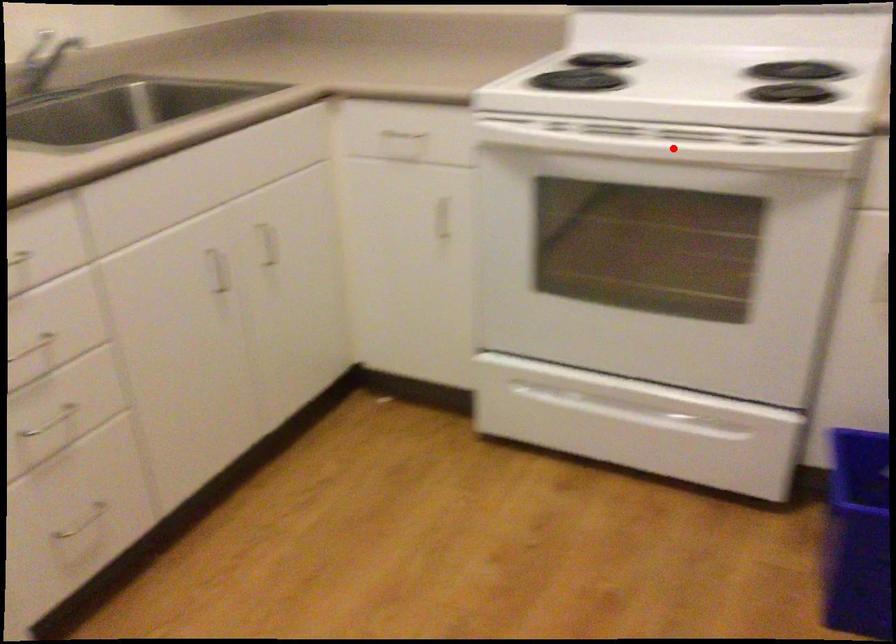
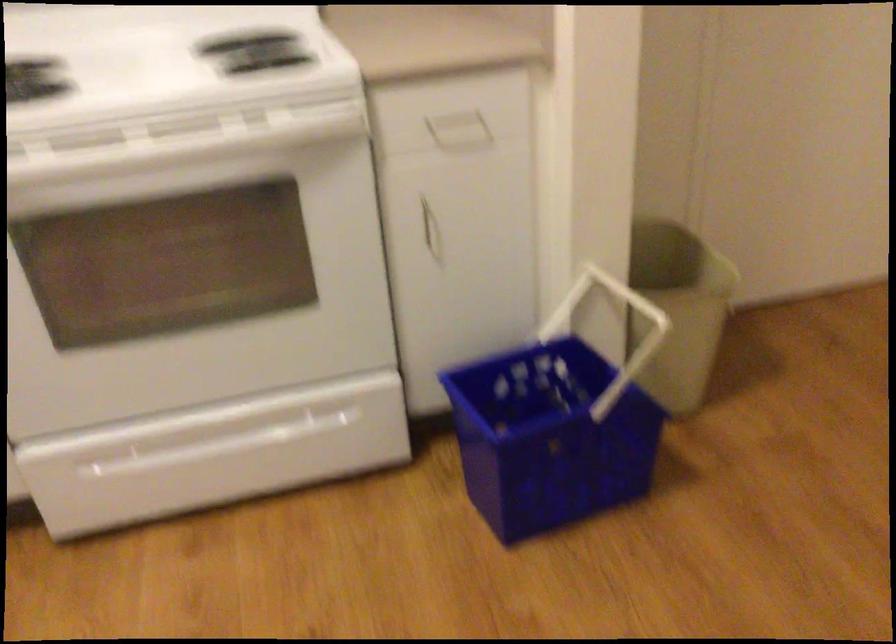
Question: I am providing you with two images of the same scene from different viewpoints. A red point is marked on the first image. At the location where the point appears in image 1, is it still visible in image 2?

Choices:
 (A) Yes
 (B) No

Answer: (A)